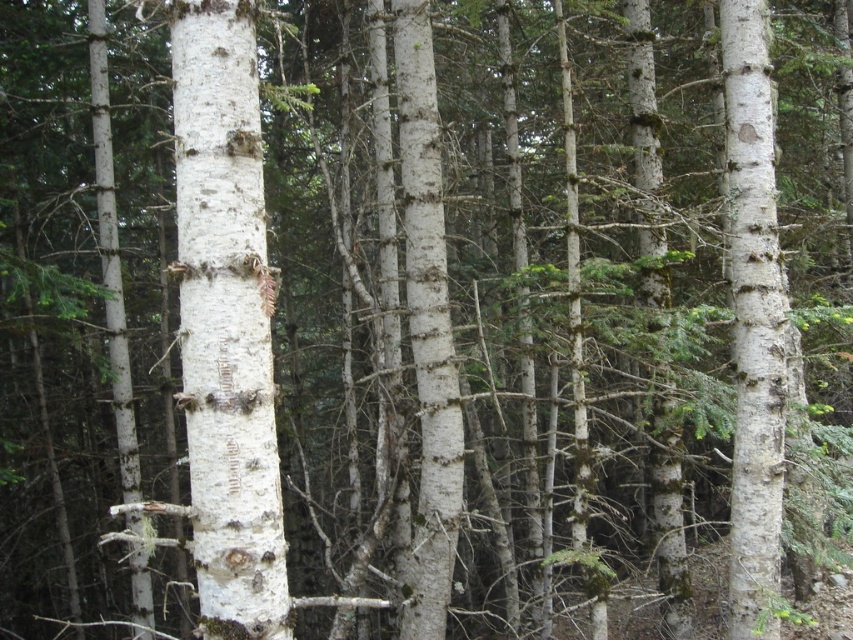
Question: Can you confirm if white bark tree trunk at center is smaller than smooth white tree trunk at right?

Choices:
 (A) no
 (B) yes

Answer: (B)

Question: Among these points, which one is farthest from the camera?

Choices:
 (A) (213, 296)
 (B) (743, 147)

Answer: (B)

Question: Can you confirm if white bark tree trunk at center is positioned to the right of smooth white tree trunk at right?

Choices:
 (A) yes
 (B) no

Answer: (B)

Question: Among these points, which one is farthest from the camera?

Choices:
 (A) (245, 291)
 (B) (761, 516)

Answer: (B)

Question: Is white bark tree trunk at center to the right of smooth white tree trunk at right from the viewer's perspective?

Choices:
 (A) yes
 (B) no

Answer: (B)